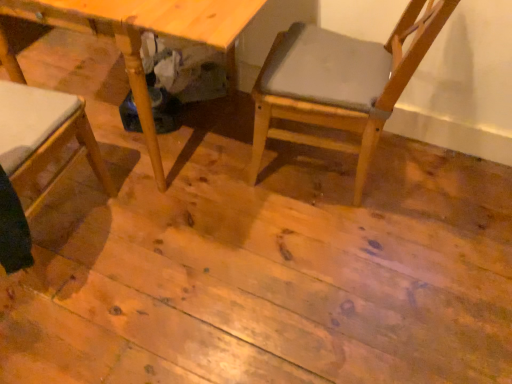
This screenshot has height=384, width=512. I want to click on vacant region under light brown wood chair at center (from a real-world perspective), so [x=303, y=161].